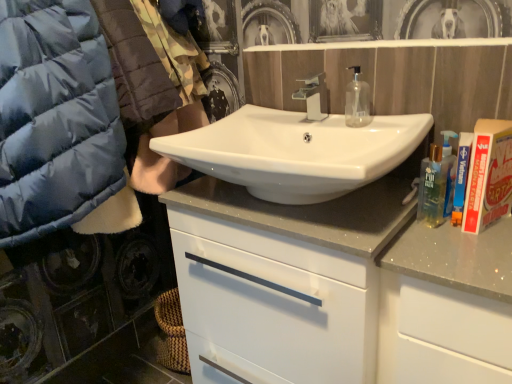
This screenshot has height=384, width=512. I want to click on free spot to the right of silver metallic faucet at center, so click(x=362, y=117).